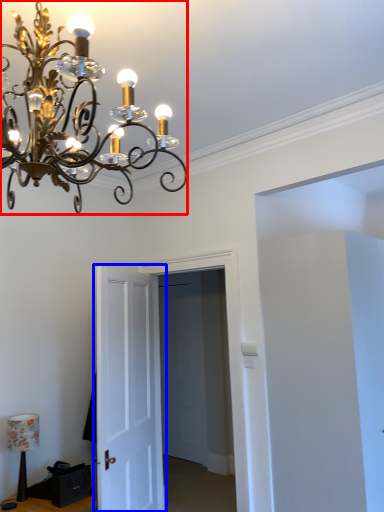
Question: Which object appears closest to the camera in this image, lamp (highlighted by a red box) or door (highlighted by a blue box)?

Choices:
 (A) lamp
 (B) door

Answer: (A)